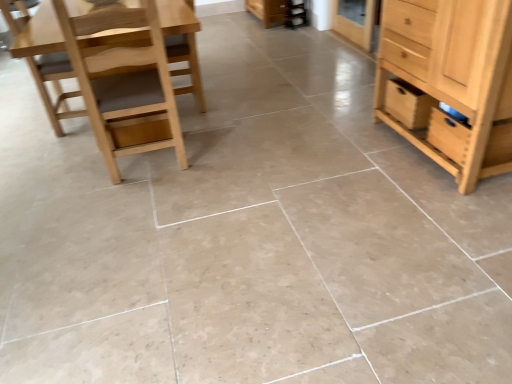
What is the approximate width of light brown wood chair at left, the first chair viewed from the right?

light brown wood chair at left, the first chair viewed from the right, is 20.00 inches wide.

Image resolution: width=512 pixels, height=384 pixels. I want to click on natural wood cabinet at right, so click(450, 81).

In order to click on chest of drawers above the light brown wood chair at left, the first chair viewed from the right (from the image's perspective) in this screenshot , I will do `click(450, 81)`.

Which object is positioned more to the right, light brown wood chair at left, marked as the 2th chair in a left-to-right arrangement, or natural wood cabinet at right?

From the viewer's perspective, natural wood cabinet at right appears more on the right side.

Which of these two, light brown wood chair at left, marked as the 2th chair in a left-to-right arrangement, or natural wood cabinet at right, stands shorter?

Standing shorter between the two is natural wood cabinet at right.

Does light brown wood chair at left, marked as the 2th chair in a left-to-right arrangement, have a larger size compared to wooden drawer at right?

Yes.

Considering their positions, is light brown wood chair at left, marked as the 2th chair in a left-to-right arrangement, located in front of or behind wooden drawer at right?

Clearly, light brown wood chair at left, marked as the 2th chair in a left-to-right arrangement, is in front of wooden drawer at right.

From a real-world perspective, is light brown wood chair at left, marked as the 2th chair in a left-to-right arrangement, below wooden drawer at right?

Incorrect, from a real-world perspective, light brown wood chair at left, marked as the 2th chair in a left-to-right arrangement, is higher than wooden drawer at right.

In terms of height, does light brown wood chair at left, the first chair viewed from the right, look taller or shorter compared to wooden drawer at right?

light brown wood chair at left, the first chair viewed from the right, is taller than wooden drawer at right.

From the image's perspective, is wooden drawer at right positioned above or below light brown wood chair at left, marked as the 2th chair in a left-to-right arrangement?

Based on their image positions, wooden drawer at right is located beneath light brown wood chair at left, marked as the 2th chair in a left-to-right arrangement.

From a real-world perspective, who is located higher, wooden drawer at right or light brown wood chair at left, the first chair viewed from the right?

In real-world perspective, light brown wood chair at left, the first chair viewed from the right, is above.

Between wooden drawer at right and light brown wood chair at left, the first chair viewed from the right, which one has smaller width?

Thinner between the two is wooden drawer at right.

Considering the sizes of objects wooden drawer at right and light brown wood chair at left, acting as the 1th chair starting from the left, in the image provided, who is bigger, wooden drawer at right or light brown wood chair at left, acting as the 1th chair starting from the left,?

Bigger between the two is light brown wood chair at left, acting as the 1th chair starting from the left.

Is light brown wood chair at left, marked as the second chair in a right-to-left arrangement, surrounded by wooden drawer at right?

No, light brown wood chair at left, marked as the second chair in a right-to-left arrangement, is not surrounded by wooden drawer at right.

Does wooden drawer at right have a greater height compared to light brown wood chair at left, marked as the second chair in a right-to-left arrangement?

Incorrect, the height of wooden drawer at right is not larger of that of light brown wood chair at left, marked as the second chair in a right-to-left arrangement.

In terms of height, does natural wood cabinet at right look taller or shorter compared to light brown wood chair at left, acting as the 1th chair starting from the left?

natural wood cabinet at right is taller than light brown wood chair at left, acting as the 1th chair starting from the left.

How much distance is there between natural wood cabinet at right and light brown wood chair at left, acting as the 1th chair starting from the left?

natural wood cabinet at right is 2.00 meters away from light brown wood chair at left, acting as the 1th chair starting from the left.

Considering the relative sizes of natural wood cabinet at right and light brown wood chair at left, acting as the 1th chair starting from the left, in the image provided, is natural wood cabinet at right thinner than light brown wood chair at left, acting as the 1th chair starting from the left,?

No.

Choose the correct answer: Is natural wood cabinet at right inside light brown wood chair at left, acting as the 1th chair starting from the left, or outside it?

natural wood cabinet at right lies outside light brown wood chair at left, acting as the 1th chair starting from the left.

Is natural wood cabinet at right wider than light brown wood chair at left, the first chair viewed from the right?

Correct, the width of natural wood cabinet at right exceeds that of light brown wood chair at left, the first chair viewed from the right.

Considering the relative sizes of natural wood cabinet at right and light brown wood chair at left, marked as the 2th chair in a left-to-right arrangement, in the image provided, is natural wood cabinet at right smaller than light brown wood chair at left, marked as the 2th chair in a left-to-right arrangement,?

No.

In the image, is natural wood cabinet at right positioned in front of or behind light brown wood chair at left, the first chair viewed from the right?

Visually, natural wood cabinet at right is located in front of light brown wood chair at left, the first chair viewed from the right.

Is natural wood cabinet at right oriented away from light brown wood chair at left, marked as the 2th chair in a left-to-right arrangement?

No.

Does natural wood cabinet at right have a smaller size compared to wooden drawer at right?

Incorrect, natural wood cabinet at right is not smaller in size than wooden drawer at right.

Would you say natural wood cabinet at right is a long distance from wooden drawer at right?

No, natural wood cabinet at right is not far from wooden drawer at right.

Is natural wood cabinet at right at the left side of wooden drawer at right?

No, natural wood cabinet at right is not to the left of wooden drawer at right.

There is a natural wood cabinet at right. Identify the location of chair above it (from a real-world perspective). (123, 80).

Find the location of a particular element. Image resolution: width=512 pixels, height=384 pixels. the 1st chair to the left of the wooden drawer at right, starting your count from the anchor is located at coordinates (123, 80).

From the image, which object appears to be nearer to light brown wood chair at left, acting as the 1th chair starting from the left, wooden drawer at right or light brown wood chair at left, the first chair viewed from the right?

light brown wood chair at left, the first chair viewed from the right, is closer to light brown wood chair at left, acting as the 1th chair starting from the left.

Which object lies nearer to the anchor point natural wood cabinet at right, light brown wood chair at left, the first chair viewed from the right, or wooden drawer at right?

wooden drawer at right.

Estimate the real-world distances between objects in this image. Which object is closer to light brown wood chair at left, acting as the 1th chair starting from the left, wooden drawer at right or natural wood cabinet at right?

wooden drawer at right is closer to light brown wood chair at left, acting as the 1th chair starting from the left.

Based on their spatial positions, is natural wood cabinet at right or light brown wood chair at left, marked as the second chair in a right-to-left arrangement, closer to wooden drawer at right?

The object closer to wooden drawer at right is natural wood cabinet at right.

When comparing their distances from light brown wood chair at left, the first chair viewed from the right, does light brown wood chair at left, acting as the 1th chair starting from the left, or natural wood cabinet at right seem closer?

Based on the image, light brown wood chair at left, acting as the 1th chair starting from the left, appears to be nearer to light brown wood chair at left, the first chair viewed from the right.

Considering their positions, is light brown wood chair at left, marked as the 2th chair in a left-to-right arrangement, positioned further to wooden drawer at right than light brown wood chair at left, marked as the second chair in a right-to-left arrangement?

The object further to wooden drawer at right is light brown wood chair at left, marked as the second chair in a right-to-left arrangement.

Based on their spatial positions, is natural wood cabinet at right or wooden drawer at right further from light brown wood chair at left, marked as the 2th chair in a left-to-right arrangement?

wooden drawer at right.

When comparing their distances from light brown wood chair at left, the first chair viewed from the right, does wooden drawer at right or light brown wood chair at left, marked as the second chair in a right-to-left arrangement, seem closer?

Based on the image, light brown wood chair at left, marked as the second chair in a right-to-left arrangement, appears to be nearer to light brown wood chair at left, the first chair viewed from the right.

Identify the location of drawer situated between light brown wood chair at left, marked as the second chair in a right-to-left arrangement, and natural wood cabinet at right from left to right. This screenshot has height=384, width=512. (408, 104).

Where is `drawer located between light brown wood chair at left, the first chair viewed from the right, and natural wood cabinet at right in the left-right direction`? drawer located between light brown wood chair at left, the first chair viewed from the right, and natural wood cabinet at right in the left-right direction is located at coordinates (408, 104).

Where is `chair situated between light brown wood chair at left, acting as the 1th chair starting from the left, and wooden drawer at right from left to right`? This screenshot has height=384, width=512. chair situated between light brown wood chair at left, acting as the 1th chair starting from the left, and wooden drawer at right from left to right is located at coordinates (123, 80).

Where is `chair between light brown wood chair at left, acting as the 1th chair starting from the left, and natural wood cabinet at right`? chair between light brown wood chair at left, acting as the 1th chair starting from the left, and natural wood cabinet at right is located at coordinates (123, 80).